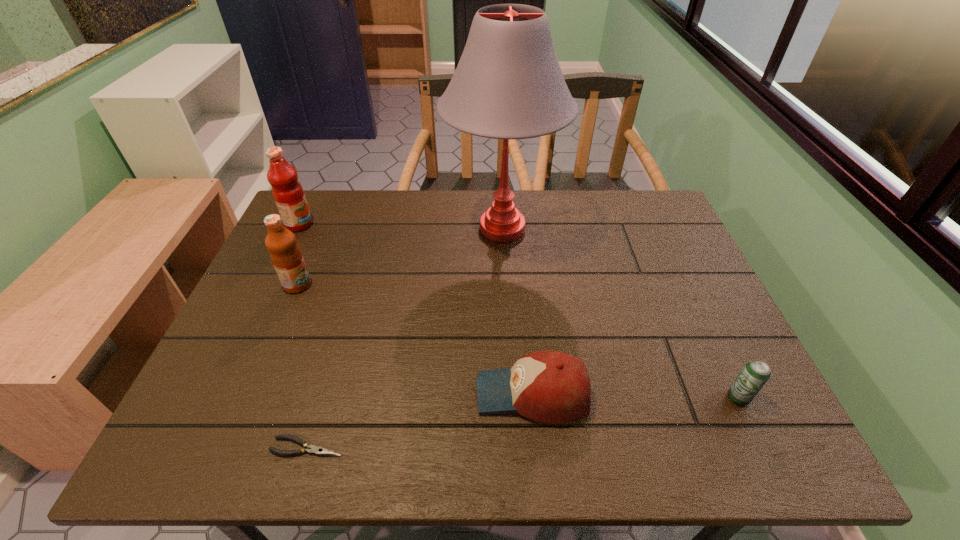
Where is `unoccupied area between the tallest object and the beer can`? This screenshot has height=540, width=960. unoccupied area between the tallest object and the beer can is located at coordinates (620, 313).

The height and width of the screenshot is (540, 960). What are the coordinates of `unoccupied position between the baseball cap and the shortest object` in the screenshot? It's located at (420, 420).

Find the location of a particular element. free space between the baseball cap and the farther fruit juice is located at coordinates (416, 309).

This screenshot has height=540, width=960. I want to click on free spot between the table lamp and the beer can, so click(x=620, y=313).

Where is `free space between the nearer fruit juice and the shortest object`? This screenshot has height=540, width=960. free space between the nearer fruit juice and the shortest object is located at coordinates (302, 366).

The height and width of the screenshot is (540, 960). Identify the location of free space between the nearer fruit juice and the baseball cap. (415, 339).

Find the location of a particular element. the fourth closest object to the third farthest object is located at coordinates (553, 387).

Identify the location of object that stands as the third closest to the baseball cap. (508, 84).

This screenshot has height=540, width=960. Find the location of `free space that satisfies the following two spatial constraints: 1. on the front label of the farther fruit juice; 2. on the left side of the shortest object`. free space that satisfies the following two spatial constraints: 1. on the front label of the farther fruit juice; 2. on the left side of the shortest object is located at coordinates (192, 447).

I want to click on vacant area in the image that satisfies the following two spatial constraints: 1. on the front-facing side of the table lamp; 2. on the left side of the beer can, so click(512, 398).